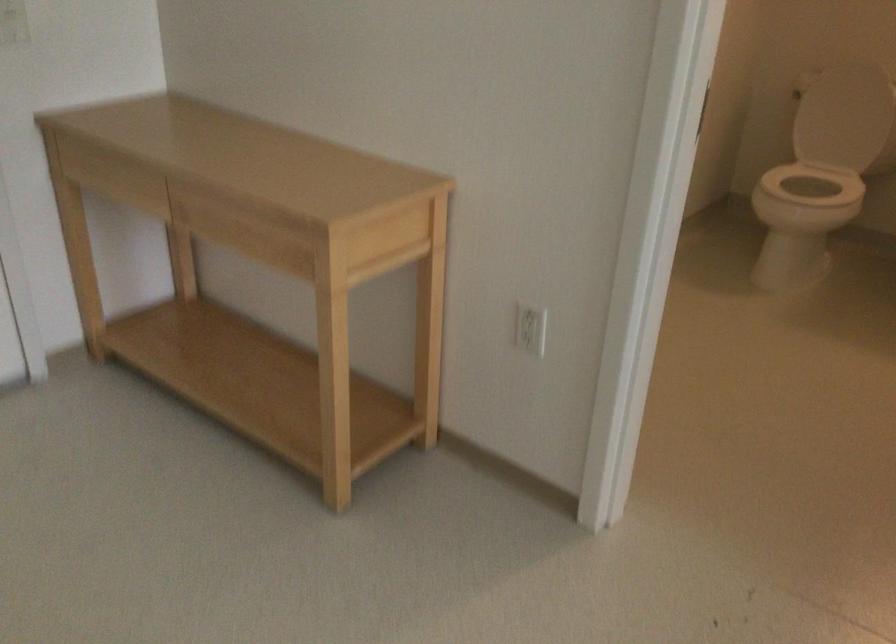
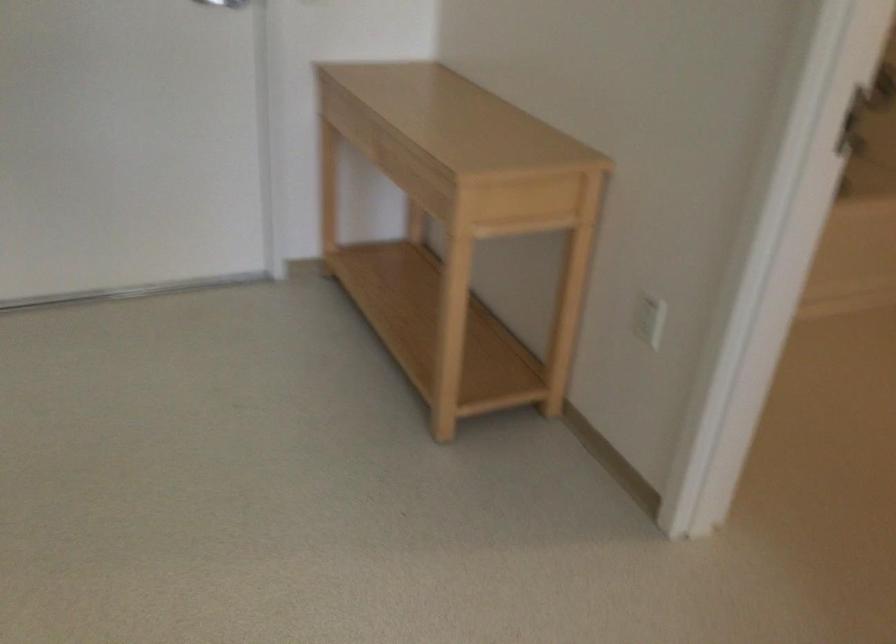
Where in the second image is the point corresponding to pixel 530 328 from the first image?

(648, 317)